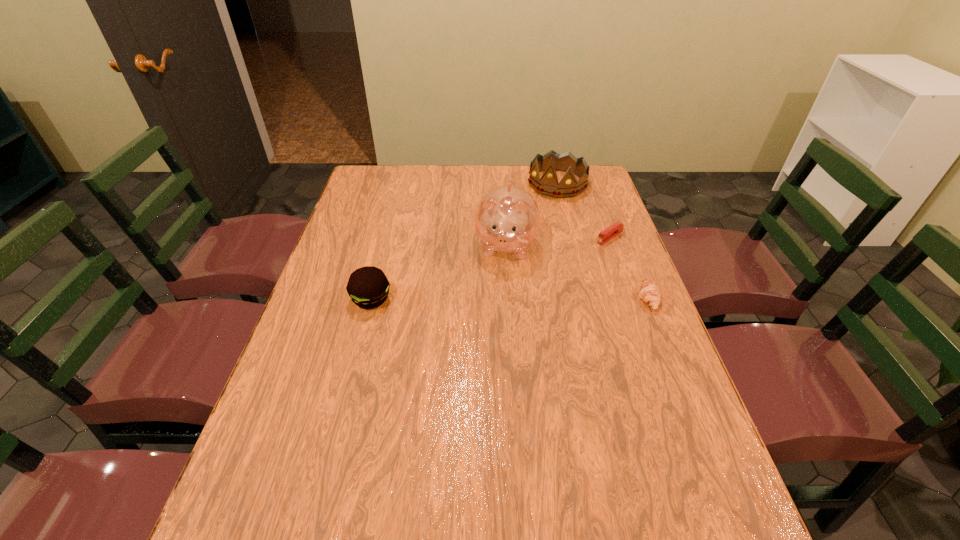
At what (x,y) coordinates should I click in order to perform the action: click on vacant space at the far right corner. Please return your answer as a coordinate pair (x, y). Looking at the image, I should click on (591, 185).

Find the location of `free space at the near right corner of the desktop`. free space at the near right corner of the desktop is located at coordinates (705, 470).

Where is `free space between the patty and the piggy bank`? This screenshot has height=540, width=960. free space between the patty and the piggy bank is located at coordinates (439, 273).

Find the location of a particular element. The height and width of the screenshot is (540, 960). vacant space that is in between the stapler and the fourth shortest object is located at coordinates (584, 211).

Locate an element on the screen. free space between the stapler and the pastry is located at coordinates (629, 268).

Image resolution: width=960 pixels, height=540 pixels. I want to click on vacant area between the tiara and the stapler, so click(x=584, y=211).

Locate an element on the screen. This screenshot has width=960, height=540. free spot between the leftmost object and the pastry is located at coordinates (510, 299).

Where is `vacant region between the third shortest object and the tallest object`? vacant region between the third shortest object and the tallest object is located at coordinates (439, 273).

Find the location of a particular element. vacant region between the stapler and the tiara is located at coordinates (584, 211).

Where is `object that is the second closest to the third tallest object`? object that is the second closest to the third tallest object is located at coordinates (548, 185).